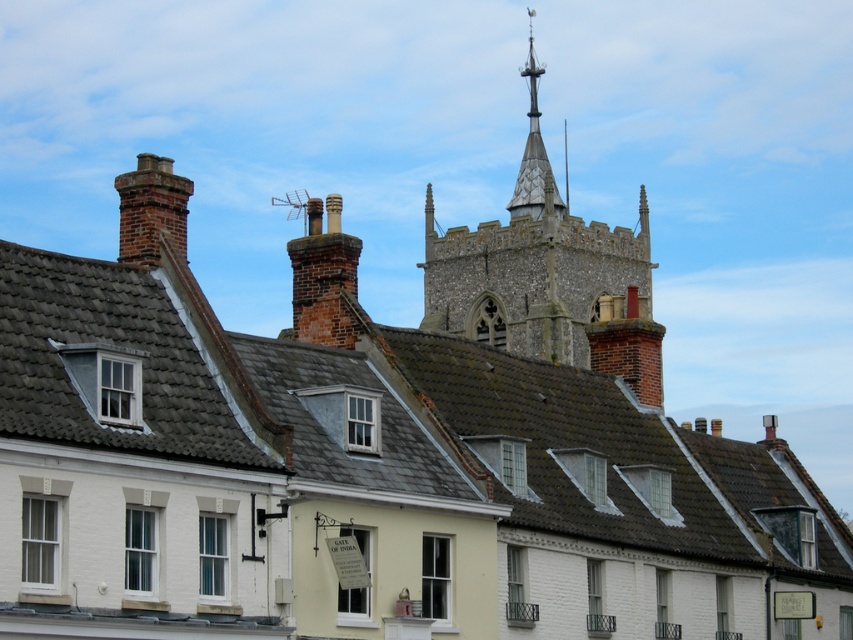
You are standing at the point with coordinates point (308, 314) and want to walk to the point with coordinates point (447, 248). According to the scene, will you be moving towards the foreground or the background?

According to the scene, point (447, 248) is behind point (308, 314). Therefore, moving from point (308, 314) to point (447, 248) means you are moving towards the background.

You are standing in front of the row of traditional English buildings and notice two brick chimneys. Which one is taller between the brick chimney at center and the brick chimney at left?

The brick chimney at center is taller than the brick chimney at left according to the description.

You are standing in front of the row of traditional English buildings and notice two brick chimneys. Which brick chimney is closer to the sky? The brick chimney at center or the brick chimney at left?

The brick chimney at center is positioned under brick chimney at left, so the brick chimney at left is closer to the sky.